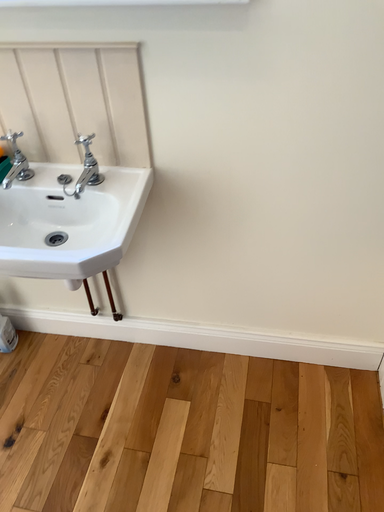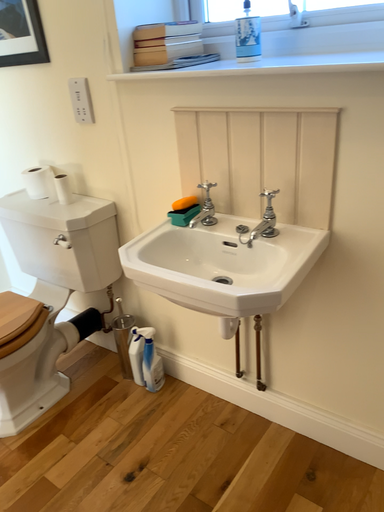
Question: How did the camera likely rotate when shooting the video?

Choices:
 (A) rotated downward
 (B) rotated upward

Answer: (B)